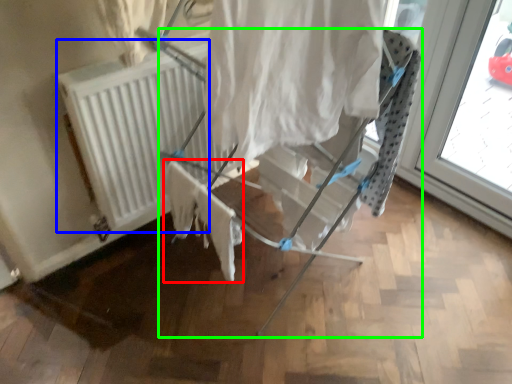
Question: Which is nearer to the fabric (highlighted by a red box)? radiator (highlighted by a blue box) or furniture (highlighted by a green box).

Choices:
 (A) radiator
 (B) furniture

Answer: (B)